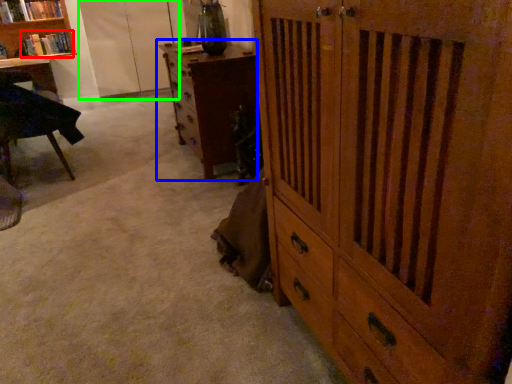
Question: Based on their relative distances, which object is farther from book (highlighted by a red box)? Choose from chest of drawers (highlighted by a blue box) and screen door (highlighted by a green box).

Choices:
 (A) chest of drawers
 (B) screen door

Answer: (A)